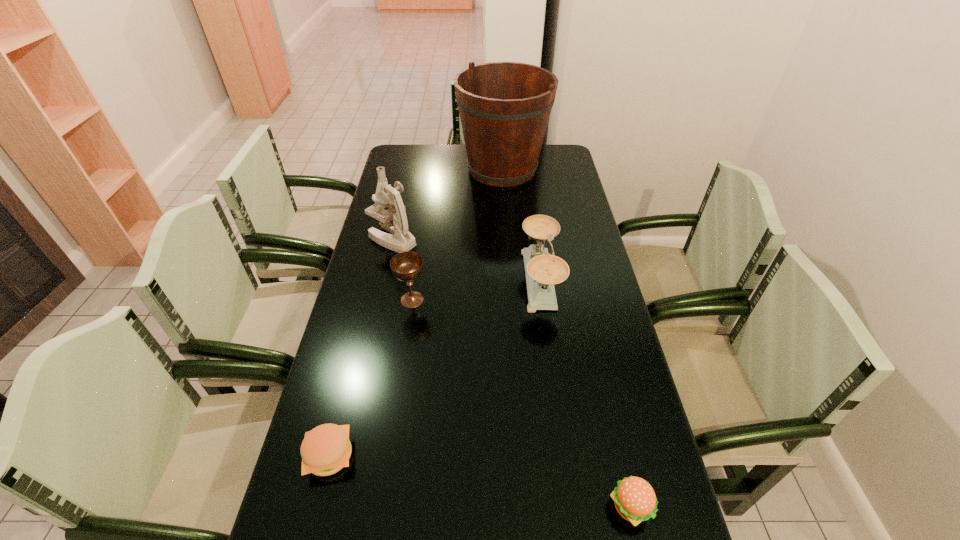
The width and height of the screenshot is (960, 540). Identify the location of hamburger situated at the left edge. (326, 449).

The height and width of the screenshot is (540, 960). Identify the location of bucket at the right edge. (504, 107).

This screenshot has width=960, height=540. Identify the location of scale that is at the right edge. pyautogui.click(x=543, y=270).

Locate an element on the screen. The height and width of the screenshot is (540, 960). hamburger located at the right edge is located at coordinates (635, 500).

The width and height of the screenshot is (960, 540). In order to click on object present at the far right corner in this screenshot , I will do `click(504, 107)`.

Image resolution: width=960 pixels, height=540 pixels. In the image, there is a desktop. What are the coordinates of `vacant space at the left edge` in the screenshot? It's located at (420, 180).

I want to click on vacant space at the right edge of the desktop, so click(x=577, y=261).

You are a GUI agent. You are given a task and a screenshot of the screen. Output one action in this format:
    pyautogui.click(x=<x>, y=<y>)
    Task: Click on the vacant space at the far left corner of the desktop
    This screenshot has height=540, width=960.
    Given the screenshot: What is the action you would take?
    pyautogui.click(x=406, y=155)

Where is `free spot between the third tallest object and the right hamburger`? Image resolution: width=960 pixels, height=540 pixels. free spot between the third tallest object and the right hamburger is located at coordinates point(585,394).

Find the location of a particular element. The height and width of the screenshot is (540, 960). unoccupied area between the left hamburger and the second tallest object is located at coordinates (361, 347).